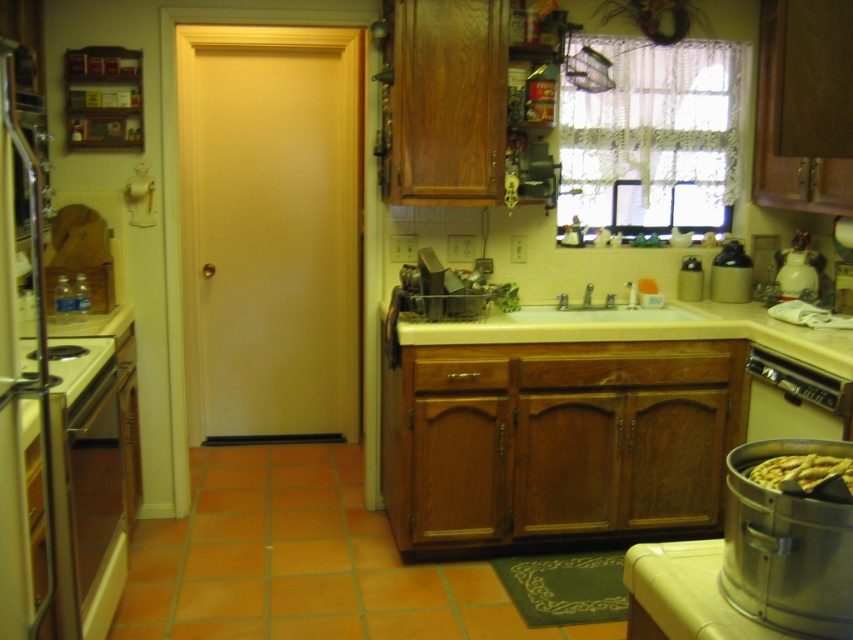
Can you confirm if white glossy sink at center is positioned below yellow matte waffle at lower right?

Incorrect, white glossy sink at center is not positioned below yellow matte waffle at lower right.

Between point (688, 316) and point (827, 461), which one is positioned in front?

Point (827, 461)

Locate an element on the screen. This screenshot has height=640, width=853. white glossy sink at center is located at coordinates (601, 316).

Which is above, silver metallic pot at lower right or stainless steel stove at left?

Positioned higher is stainless steel stove at left.

Who is more distant from viewer, (846, 556) or (99, 346)?

Positioned behind is point (99, 346).

Is point (784, 620) farther from viewer compared to point (57, 369)?

No, it is in front of (57, 369).

Where is `silver metallic pot at lower right`? silver metallic pot at lower right is located at coordinates (786, 547).

Can you confirm if satin silver oven at lower left is bigger than satin silver dishwasher at lower right?

Indeed, satin silver oven at lower left has a larger size compared to satin silver dishwasher at lower right.

Is point (125, 556) closer to camera compared to point (798, 410)?

Yes, point (125, 556) is closer to viewer.

This screenshot has height=640, width=853. Identify the location of satin silver oven at lower left. (102, 492).